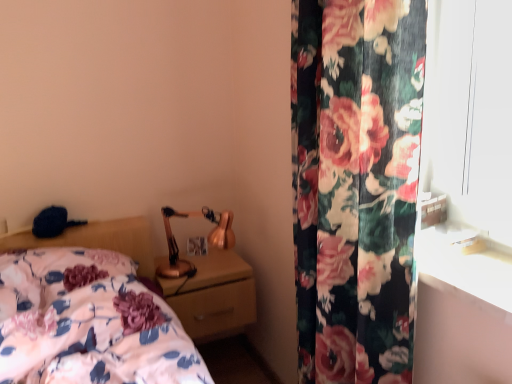
Question: In terms of height, does floral fabric curtain at right look taller or shorter compared to floral fabric bed at lower left?

Choices:
 (A) tall
 (B) short

Answer: (A)

Question: In terms of width, does floral fabric curtain at right look wider or thinner when compared to floral fabric bed at lower left?

Choices:
 (A) wide
 (B) thin

Answer: (B)

Question: Estimate the real-world distances between objects in this image. Which object is closer to the copper metallic table lamp at upper right?

Choices:
 (A) floral fabric bed at lower left
 (B) matte gold nightstand at center
 (C) floral fabric curtain at right

Answer: (B)

Question: Estimate the real-world distances between objects in this image. Which object is closer to the matte gold nightstand at center?

Choices:
 (A) floral fabric bed at lower left
 (B) floral fabric curtain at right
 (C) copper metallic table lamp at upper right

Answer: (C)